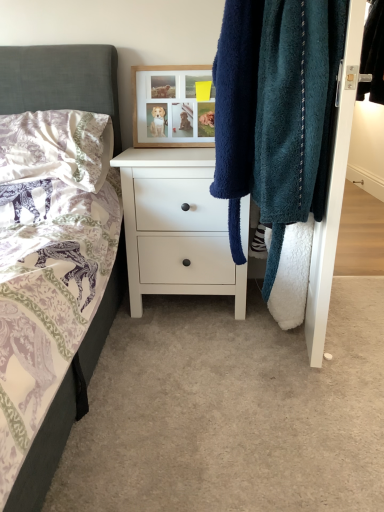
Where is `white textured pillow at upper left`? The image size is (384, 512). white textured pillow at upper left is located at coordinates (56, 147).

What is the approximate width of black leather jacket at upper right?

black leather jacket at upper right is 8.83 inches in width.

What do you see at coordinates (176, 227) in the screenshot? I see `white matte chest of drawers at center` at bounding box center [176, 227].

Identify the location of teal fuzzy towel at right. The width and height of the screenshot is (384, 512). (333, 196).

The image size is (384, 512). Describe the element at coordinates (173, 106) in the screenshot. I see `wooden picture frame at upper center` at that location.

You are a GUI agent. You are given a task and a screenshot of the screen. Output one action in this format:
    pyautogui.click(x=<x>, y=<y>)
    Task: Click on the white textured pillow at upper left
    This screenshot has width=384, height=512.
    Given the screenshot: What is the action you would take?
    pos(56,147)

How far apart are wooden picture frame at upper center and white matte chest of drawers at center?

They are 36.93 centimeters apart.

From a real-world perspective, does wooden picture frame at upper center sit lower than white matte chest of drawers at center?

No, from a real-world perspective, wooden picture frame at upper center is not below white matte chest of drawers at center.

From the image's perspective, who appears lower, wooden picture frame at upper center or white matte chest of drawers at center?

white matte chest of drawers at center, from the image's perspective.

How different are the orientations of wooden picture frame at upper center and white matte chest of drawers at center in degrees?

wooden picture frame at upper center and white matte chest of drawers at center are facing 0.00152 degrees away from each other.

Does white textured pillow at upper left have a greater width compared to white matte chest of drawers at center?

Incorrect, the width of white textured pillow at upper left does not surpass that of white matte chest of drawers at center.

Considering the positions of objects white textured pillow at upper left and white matte chest of drawers at center in the image provided, who is more to the left, white textured pillow at upper left or white matte chest of drawers at center?

Positioned to the left is white textured pillow at upper left.

How much distance is there between white textured pillow at upper left and white matte chest of drawers at center?

white textured pillow at upper left and white matte chest of drawers at center are 29.84 centimeters apart from each other.

Is the position of white textured pillow at upper left less distant than that of white matte chest of drawers at center?

Yes, white textured pillow at upper left is closer to the camera.

Does black leather jacket at upper right have a lesser height compared to teal fuzzy towel at right?

Yes, black leather jacket at upper right is shorter than teal fuzzy towel at right.

From the image's perspective, would you say black leather jacket at upper right is shown under teal fuzzy towel at right?

No.

Which is nearer, (369, 38) or (338, 134)?

The point (338, 134) is closer.

How many degrees apart are the facing directions of black leather jacket at upper right and teal fuzzy towel at right?

The facing directions of black leather jacket at upper right and teal fuzzy towel at right are 5.05 degrees apart.

Looking at the image, does wooden picture frame at upper center seem bigger or smaller compared to black leather jacket at upper right?

Considering their sizes, wooden picture frame at upper center takes up less space than black leather jacket at upper right.

Consider the image. Is wooden picture frame at upper center to the right of black leather jacket at upper right from the viewer's perspective?

In fact, wooden picture frame at upper center is to the left of black leather jacket at upper right.

From a real-world perspective, who is located higher, wooden picture frame at upper center or black leather jacket at upper right?

black leather jacket at upper right, from a real-world perspective.

Is point (134, 89) closer or farther from the camera than point (373, 51)?

Point (134, 89) appears to be farther away from the viewer than point (373, 51).

In the image, is white textured pillow at upper left on the left side or the right side of black leather jacket at upper right?

Based on their positions, white textured pillow at upper left is located to the left of black leather jacket at upper right.

The height and width of the screenshot is (512, 384). I want to click on clothing that appears above the white textured pillow at upper left (from a real-world perspective), so click(x=373, y=54).

In the scene shown: Is white textured pillow at upper left oriented away from black leather jacket at upper right?

No, white textured pillow at upper left is not facing the opposite direction of black leather jacket at upper right.

From the image's perspective, is white textured pillow at upper left on top of black leather jacket at upper right?

No, from the image's perspective, white textured pillow at upper left is not over black leather jacket at upper right.

Is white matte chest of drawers at center inside or outside of black leather jacket at upper right?

white matte chest of drawers at center is not inside black leather jacket at upper right, it's outside.

Between white matte chest of drawers at center and black leather jacket at upper right, which one is positioned in front?

white matte chest of drawers at center is more forward.

Considering the sizes of objects white matte chest of drawers at center and black leather jacket at upper right in the image provided, who is bigger, white matte chest of drawers at center or black leather jacket at upper right?

With larger size is white matte chest of drawers at center.

Is white matte chest of drawers at center placed right next to black leather jacket at upper right?

No, white matte chest of drawers at center is not in contact with black leather jacket at upper right.

How much distance is there between white textured pillow at upper left and wooden picture frame at upper center?

The distance of white textured pillow at upper left from wooden picture frame at upper center is 13.31 inches.

Considering the relative sizes of white textured pillow at upper left and wooden picture frame at upper center in the image provided, is white textured pillow at upper left shorter than wooden picture frame at upper center?

Indeed, white textured pillow at upper left has a lesser height compared to wooden picture frame at upper center.

Based on the photo, is white textured pillow at upper left not inside wooden picture frame at upper center?

That's correct, white textured pillow at upper left is outside of wooden picture frame at upper center.

The width and height of the screenshot is (384, 512). I want to click on picture frame that appears behind the white matte chest of drawers at center, so click(173, 106).

The height and width of the screenshot is (512, 384). In order to click on pillow above the white matte chest of drawers at center (from the image's perspective) in this screenshot , I will do `click(56, 147)`.

From the image, which object appears to be nearer to white matte chest of drawers at center, teal fuzzy towel at right or wooden picture frame at upper center?

wooden picture frame at upper center.

Considering their positions, is white textured pillow at upper left positioned closer to white matte chest of drawers at center than teal fuzzy towel at right?

Based on the image, white textured pillow at upper left appears to be nearer to white matte chest of drawers at center.

Looking at the image, which one is located closer to white textured pillow at upper left, teal fuzzy towel at right or white matte chest of drawers at center?

white matte chest of drawers at center lies closer to white textured pillow at upper left than the other object.

Estimate the real-world distances between objects in this image. Which object is closer to white matte chest of drawers at center, white textured pillow at upper left or wooden picture frame at upper center?

white textured pillow at upper left is closer to white matte chest of drawers at center.

Considering their positions, is white textured pillow at upper left positioned further to wooden picture frame at upper center than white matte chest of drawers at center?

white matte chest of drawers at center.

Looking at the image, which one is located further to white matte chest of drawers at center, teal fuzzy towel at right or white textured pillow at upper left?

teal fuzzy towel at right lies further to white matte chest of drawers at center than the other object.

Estimate the real-world distances between objects in this image. Which object is further from white matte chest of drawers at center, black leather jacket at upper right or teal fuzzy towel at right?

black leather jacket at upper right.

When comparing their distances from white matte chest of drawers at center, does white textured pillow at upper left or black leather jacket at upper right seem closer?

Among the two, white textured pillow at upper left is located nearer to white matte chest of drawers at center.

This screenshot has width=384, height=512. In order to click on the chest of drawers situated between white textured pillow at upper left and teal fuzzy towel at right from left to right in this screenshot , I will do `click(176, 227)`.

At what (x,y) coordinates should I click in order to perform the action: click on closet situated between white textured pillow at upper left and black leather jacket at upper right from left to right. Please return your answer as a coordinate pair (x, y). Looking at the image, I should click on (333, 196).

Where is `picture frame between white textured pillow at upper left and black leather jacket at upper right from left to right`? Image resolution: width=384 pixels, height=512 pixels. picture frame between white textured pillow at upper left and black leather jacket at upper right from left to right is located at coordinates (173, 106).

Find the location of `chest of drawers between teal fuzzy towel at right and black leather jacket at upper right from front to back`. chest of drawers between teal fuzzy towel at right and black leather jacket at upper right from front to back is located at coordinates (176, 227).